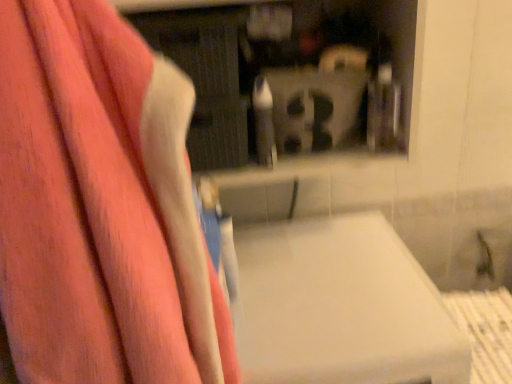
Question: From a real-world perspective, does matte plastic shelf at upper center stand above white matte lift at center?

Choices:
 (A) no
 (B) yes

Answer: (B)

Question: Can you confirm if matte plastic shelf at upper center is smaller than white matte lift at center?

Choices:
 (A) yes
 (B) no

Answer: (A)

Question: Does matte plastic shelf at upper center appear on the right side of white matte lift at center?

Choices:
 (A) yes
 (B) no

Answer: (B)

Question: Is matte plastic shelf at upper center looking in the opposite direction of white matte lift at center?

Choices:
 (A) no
 (B) yes

Answer: (A)

Question: From the image's perspective, is matte plastic shelf at upper center on white matte lift at center?

Choices:
 (A) yes
 (B) no

Answer: (A)

Question: Is matte plastic shelf at upper center not inside white matte lift at center?

Choices:
 (A) yes
 (B) no

Answer: (A)

Question: Is the surface of pink fabric towel at left in direct contact with white matte lift at center?

Choices:
 (A) no
 (B) yes

Answer: (A)

Question: Considering the relative sizes of pink fabric towel at left and white matte lift at center in the image provided, is pink fabric towel at left smaller than white matte lift at center?

Choices:
 (A) no
 (B) yes

Answer: (B)

Question: Could you tell me if pink fabric towel at left is turned towards white matte lift at center?

Choices:
 (A) no
 (B) yes

Answer: (A)

Question: Are pink fabric towel at left and white matte lift at center located far from each other?

Choices:
 (A) yes
 (B) no

Answer: (B)

Question: From a real-world perspective, is pink fabric towel at left below white matte lift at center?

Choices:
 (A) no
 (B) yes

Answer: (A)

Question: Considering the relative positions of pink fabric towel at left and white matte lift at center in the image provided, is pink fabric towel at left to the left of white matte lift at center from the viewer's perspective?

Choices:
 (A) yes
 (B) no

Answer: (A)

Question: From the image's perspective, is matte plastic shelf at upper center above pink fabric towel at left?

Choices:
 (A) no
 (B) yes

Answer: (B)